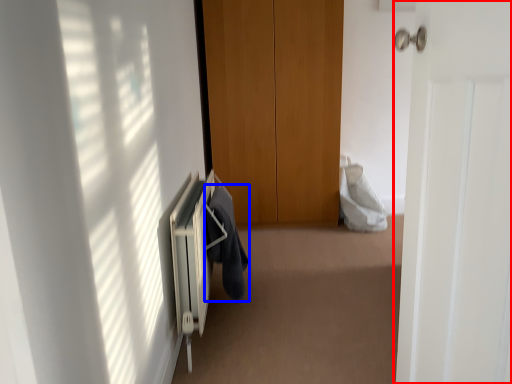
Question: Which of the following is the closest to the observer, door (highlighted by a red box) or garment (highlighted by a blue box)?

Choices:
 (A) door
 (B) garment

Answer: (A)